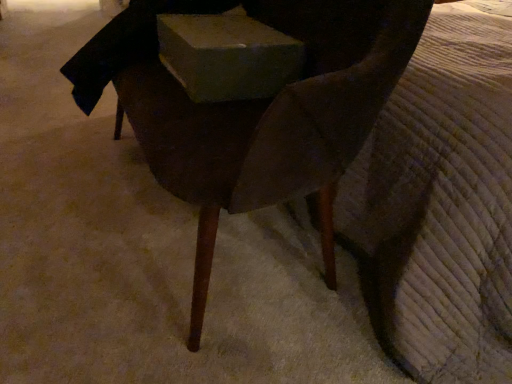
Question: Is point (243, 23) closer or farther from the camera than point (252, 147)?

Choices:
 (A) farther
 (B) closer

Answer: (A)

Question: Considering the positions of matte gray box at center and dark wood chair at center in the image, is matte gray box at center taller or shorter than dark wood chair at center?

Choices:
 (A) tall
 (B) short

Answer: (B)

Question: From a real-world perspective, is matte gray box at center physically located above or below dark wood chair at center?

Choices:
 (A) above
 (B) below

Answer: (A)

Question: In the image, is dark wood chair at center positioned in front of or behind matte gray box at center?

Choices:
 (A) behind
 (B) front

Answer: (B)

Question: From a real-world perspective, is dark wood chair at center physically located above or below matte gray box at center?

Choices:
 (A) above
 (B) below

Answer: (B)

Question: Considering the positions of dark wood chair at center and matte gray box at center in the image, is dark wood chair at center taller or shorter than matte gray box at center?

Choices:
 (A) short
 (B) tall

Answer: (B)

Question: Is point (380, 66) closer or farther from the camera than point (249, 56)?

Choices:
 (A) closer
 (B) farther

Answer: (A)